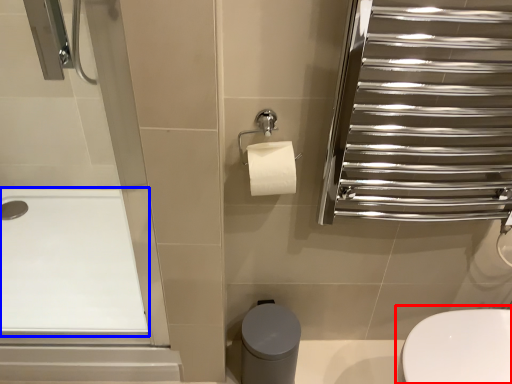
Question: Which of the following is the farthest to the observer, toilet (highlighted by a red box) or bath (highlighted by a blue box)?

Choices:
 (A) toilet
 (B) bath

Answer: (B)